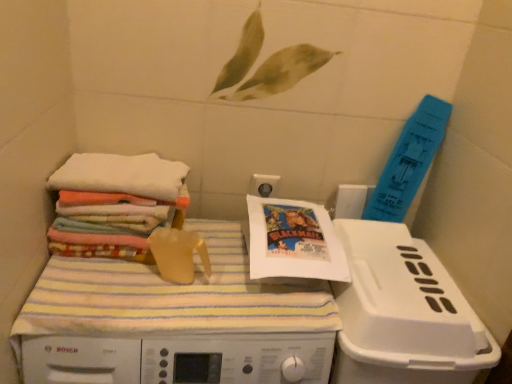
Question: Is white paper comic book at center at the left side of white soft towels at left?

Choices:
 (A) no
 (B) yes

Answer: (A)

Question: Is white paper comic book at center positioned far away from white soft towels at left?

Choices:
 (A) no
 (B) yes

Answer: (A)

Question: Are white paper comic book at center and white soft towels at left making contact?

Choices:
 (A) no
 (B) yes

Answer: (A)

Question: Considering the relative sizes of white paper comic book at center and white soft towels at left in the image provided, is white paper comic book at center wider than white soft towels at left?

Choices:
 (A) no
 (B) yes

Answer: (A)

Question: Can you confirm if white paper comic book at center is bigger than white soft towels at left?

Choices:
 (A) yes
 (B) no

Answer: (A)

Question: In the image, is white paper comic book at center on the left side or the right side of white plastic dish washer at lower right?

Choices:
 (A) right
 (B) left

Answer: (B)

Question: Does point (271, 198) appear closer or farther from the camera than point (416, 362)?

Choices:
 (A) closer
 (B) farther

Answer: (B)

Question: In terms of height, does white paper comic book at center look taller or shorter compared to white plastic dish washer at lower right?

Choices:
 (A) tall
 (B) short

Answer: (B)

Question: Looking at the image, does white paper comic book at center seem bigger or smaller compared to white plastic dish washer at lower right?

Choices:
 (A) big
 (B) small

Answer: (B)

Question: From the image's perspective, is white plastic dish washer at lower right located above or below white soft towels at left?

Choices:
 (A) above
 (B) below

Answer: (B)

Question: Considering the positions of white plastic dish washer at lower right and white soft towels at left in the image, is white plastic dish washer at lower right bigger or smaller than white soft towels at left?

Choices:
 (A) small
 (B) big

Answer: (B)

Question: Does point (416, 324) appear closer or farther from the camera than point (66, 162)?

Choices:
 (A) farther
 (B) closer

Answer: (B)

Question: From their relative heights in the image, would you say white plastic dish washer at lower right is taller or shorter than white soft towels at left?

Choices:
 (A) short
 (B) tall

Answer: (B)

Question: Is white plastic machine at center to the left or to the right of multicolored fabric stack at left in the image?

Choices:
 (A) left
 (B) right

Answer: (B)

Question: In terms of height, does white plastic machine at center look taller or shorter compared to multicolored fabric stack at left?

Choices:
 (A) short
 (B) tall

Answer: (B)